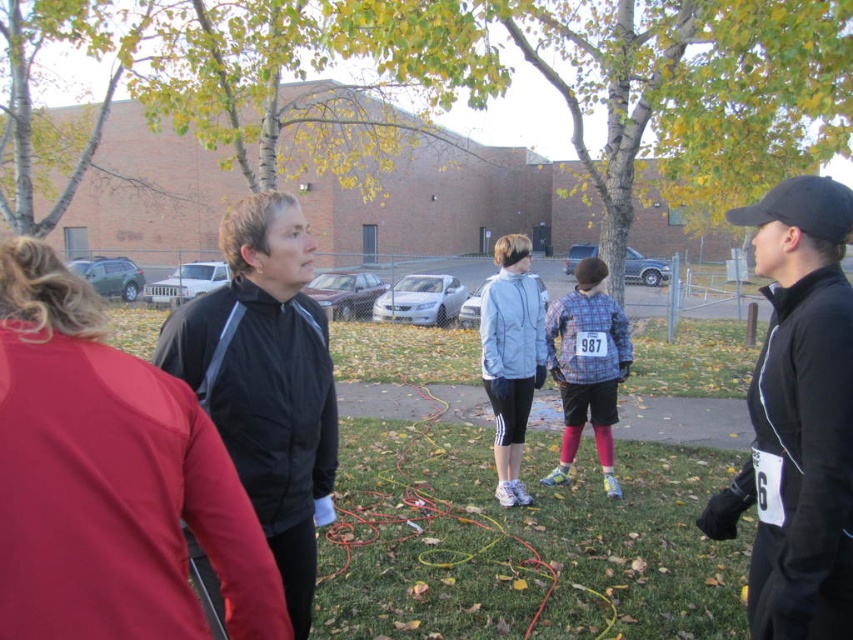
From the picture: Is matte black jacket at center smaller than light blue fabric jacket at center?

Correct, matte black jacket at center occupies less space than light blue fabric jacket at center.

You are a GUI agent. You are given a task and a screenshot of the screen. Output one action in this format:
    pyautogui.click(x=<x>, y=<y>)
    Task: Click on the matte black jacket at center
    This screenshot has height=640, width=853.
    Given the screenshot: What is the action you would take?
    pyautogui.click(x=109, y=480)

Is point (0, 502) closer to camera compared to point (543, 356)?

Yes.

Identify the location of matte black jacket at center. (109, 480).

Is matte black jacket at center further to the viewer compared to plaid fabric shirt at center?

No, it is in front of plaid fabric shirt at center.

Does point (149, 438) come closer to viewer compared to point (605, 426)?

That is True.

The width and height of the screenshot is (853, 640). Find the location of `matte black jacket at center`. matte black jacket at center is located at coordinates (109, 480).

Is the position of black matte jacket at left less distant than that of plaid fabric shirt at center?

Yes, black matte jacket at left is closer to the viewer.

Find the location of a particular element. This screenshot has height=640, width=853. black matte jacket at left is located at coordinates (265, 381).